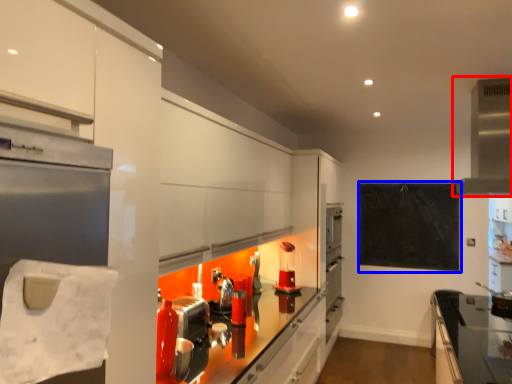
Question: Among these objects, which one is farthest to the camera, exhaust hood (highlighted by a red box) or bulletin board (highlighted by a blue box)?

Choices:
 (A) exhaust hood
 (B) bulletin board

Answer: (B)